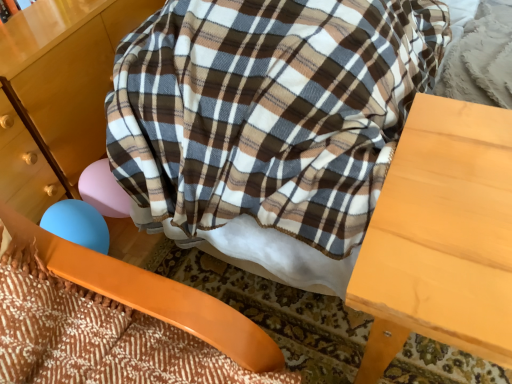
What is the approximate height of orange plastic rocking chair at lower left?

The height of orange plastic rocking chair at lower left is 16.77 inches.

The height and width of the screenshot is (384, 512). What do you see at coordinates (112, 322) in the screenshot?
I see `orange plastic rocking chair at lower left` at bounding box center [112, 322].

Locate an element on the screen. The image size is (512, 384). orange plastic rocking chair at lower left is located at coordinates (112, 322).

I want to click on orange plastic rocking chair at lower left, so click(x=112, y=322).